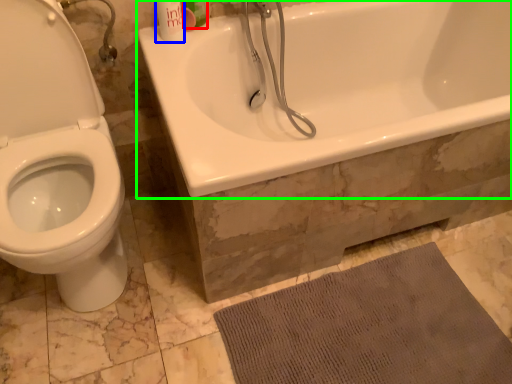
Question: Which is farther away from mouthwash (highlighted by a red box)? mouthwash (highlighted by a blue box) or bathtub (highlighted by a green box)?

Choices:
 (A) mouthwash
 (B) bathtub

Answer: (B)